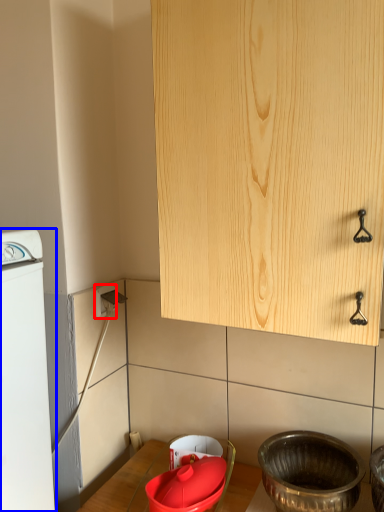
Question: Among these objects, which one is farthest to the camera, electric outlet (highlighted by a red box) or home appliance (highlighted by a blue box)?

Choices:
 (A) electric outlet
 (B) home appliance

Answer: (A)